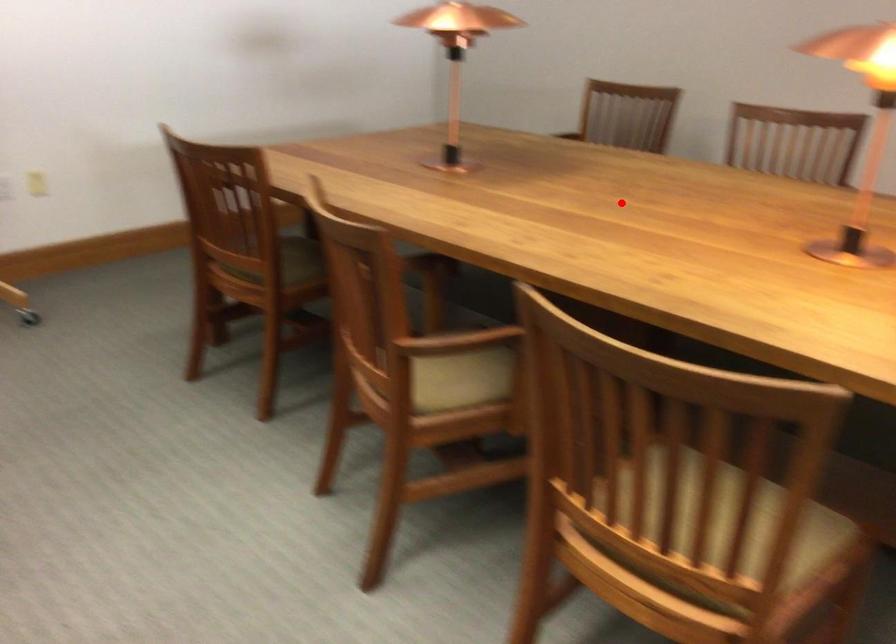
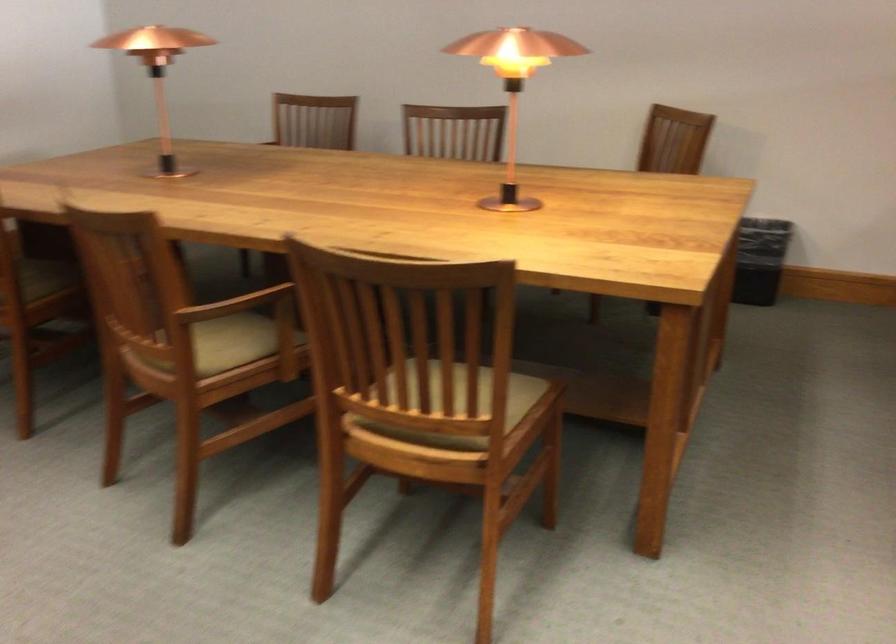
Question: I am providing you with two images of the same scene from different viewpoints. A red point is marked on the first image. Can you still see the location of the red point in image 2?

Choices:
 (A) Yes
 (B) No

Answer: (A)